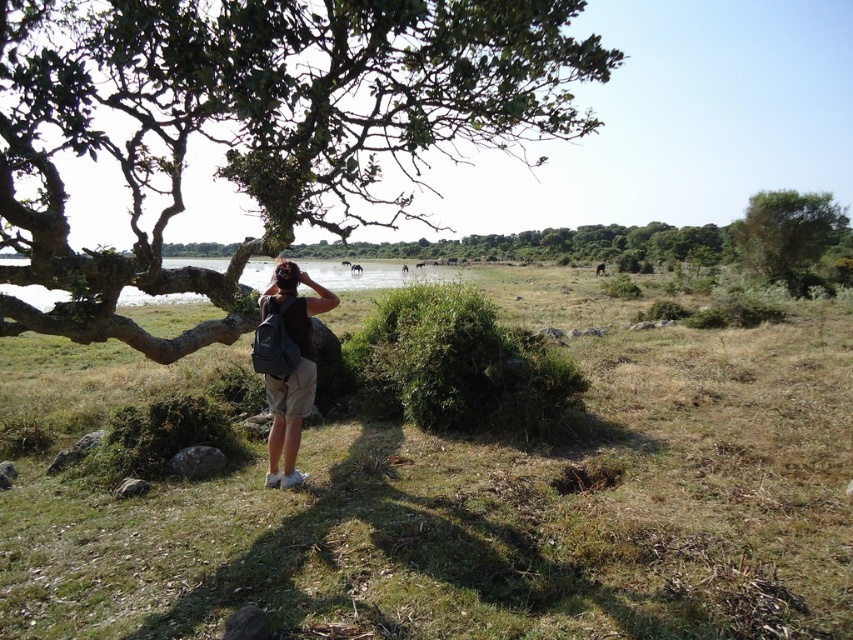
You are a photographer trying to capture both the green leafy tree at upper left and the green leafy bush at upper right in your frame. Based on their sizes, which one will appear wider in the photo?

The green leafy tree at upper left will appear wider in the photo since its width is larger than the green leafy bush at upper right.

You are a photographer trying to capture the green leafy tree at upper left. You are holding a camera. If you move 2 feet closer to the tree, how far will you be from the tree?

After moving 2 feet closer, you will be 5.15 feet away from the green leafy tree at upper left.